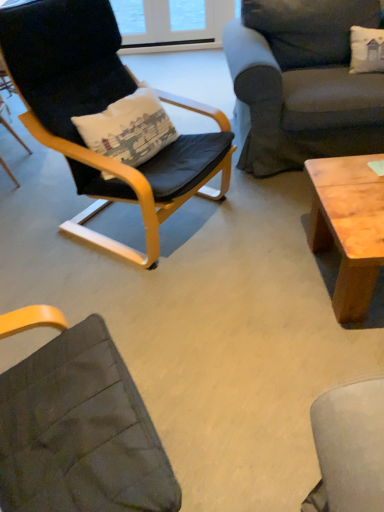
At what (x,y) coordinates should I click in order to perform the action: click on free spot to the right of matte black chair at left, which ranks as the first chair in left-to-right order. Please return your answer as a coordinate pair (x, y). Looking at the image, I should click on point(50,175).